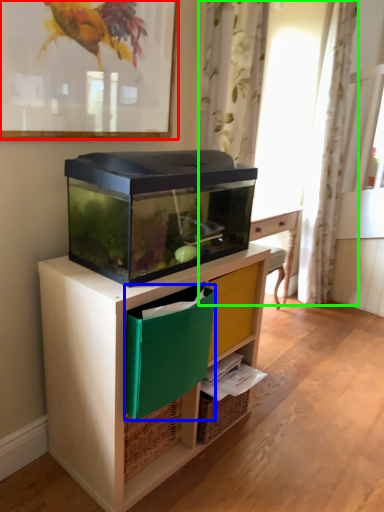
Question: Based on their relative distances, which object is nearer to picture frame (highlighted by a red box)? Choose from storage box (highlighted by a blue box) and curtain (highlighted by a green box).

Choices:
 (A) storage box
 (B) curtain

Answer: (A)